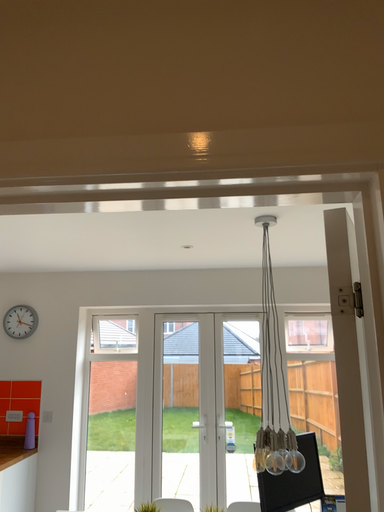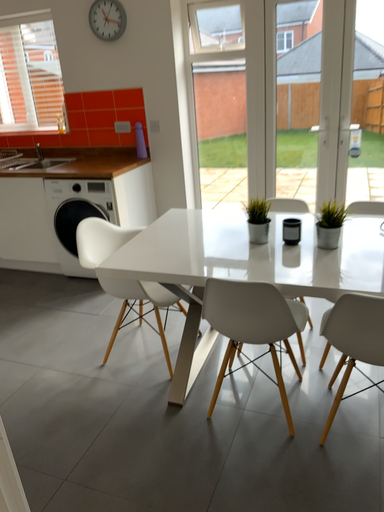
Question: How did the camera likely rotate when shooting the video?

Choices:
 (A) rotated upward
 (B) rotated downward

Answer: (B)